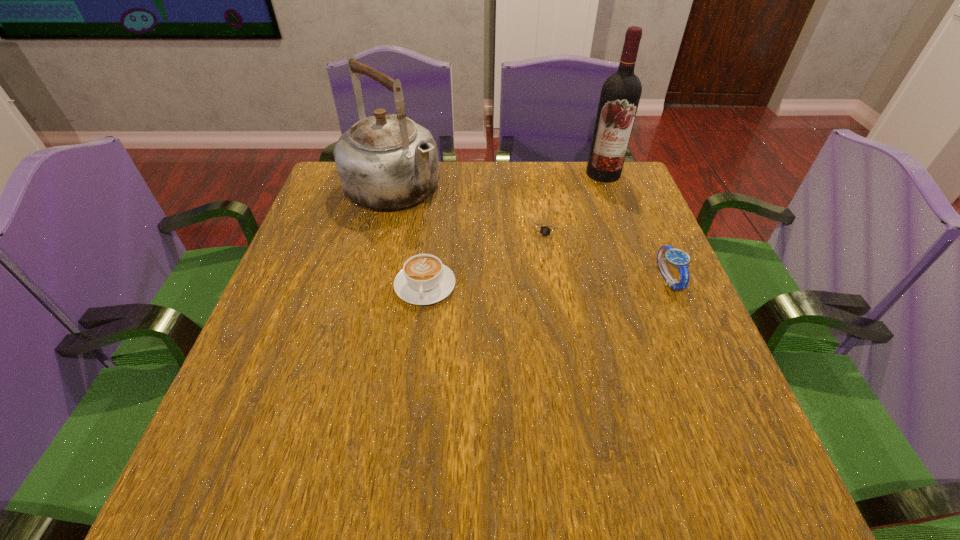
You are a GUI agent. You are given a task and a screenshot of the screen. Output one action in this format:
    pyautogui.click(x=<x>, y=<y>)
    Task: Click on the fourth tallest object
    The width and height of the screenshot is (960, 540).
    Given the screenshot: What is the action you would take?
    pyautogui.click(x=424, y=280)

You are a GUI agent. You are given a task and a screenshot of the screen. Output one action in this format:
    pyautogui.click(x=<x>, y=<y>)
    Task: Click on the right watch
    Image resolution: width=960 pixels, height=540 pixels.
    Given the screenshot: What is the action you would take?
    pyautogui.click(x=678, y=258)

Find the location of a particular element. This screenshot has height=540, width=960. the third tallest object is located at coordinates point(678,258).

The width and height of the screenshot is (960, 540). Find the location of `the tallest object`. the tallest object is located at coordinates (620, 95).

You are a GUI agent. You are given a task and a screenshot of the screen. Output one action in this format:
    pyautogui.click(x=<x>, y=<y>)
    Task: Click on the shorter watch
    Image resolution: width=960 pixels, height=540 pixels.
    Given the screenshot: What is the action you would take?
    pyautogui.click(x=548, y=231)

At what (x,y) coordinates should I click in order to perform the action: click on the farther watch. Please return your answer as a coordinate pair (x, y). This screenshot has height=540, width=960. Looking at the image, I should click on (548, 231).

Locate an element on the screen. The image size is (960, 540). the fourth shortest object is located at coordinates (387, 161).

Where is `free space located 0.240m on the side of the second shortest object with the handle`? free space located 0.240m on the side of the second shortest object with the handle is located at coordinates (410, 414).

Image resolution: width=960 pixels, height=540 pixels. I want to click on vacant region located 0.290m on the front of the taller watch, so click(729, 424).

The image size is (960, 540). Identify the location of vacant point located on the label of the wine bottle. (567, 235).